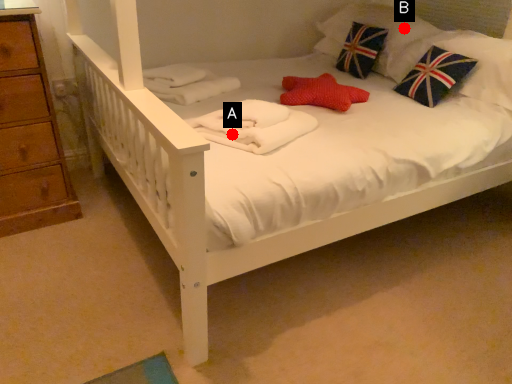
Question: Two points are circled on the image, labeled by A and B beside each circle. Which point is closer to the camera?

Choices:
 (A) A is closer
 (B) B is closer

Answer: (A)